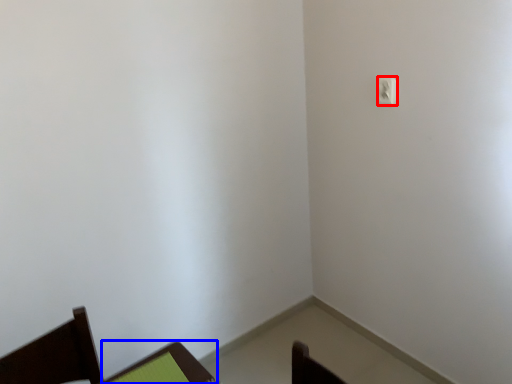
Question: Which object appears closest to the camera in this image, light switch (highlighted by a red box) or furniture (highlighted by a blue box)?

Choices:
 (A) light switch
 (B) furniture

Answer: (B)